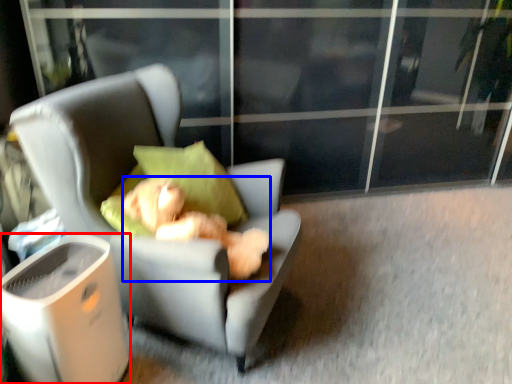
Question: Among these objects, which one is nearest to the camera, trash bin/can (highlighted by a red box) or teddy bear (highlighted by a blue box)?

Choices:
 (A) trash bin/can
 (B) teddy bear

Answer: (A)